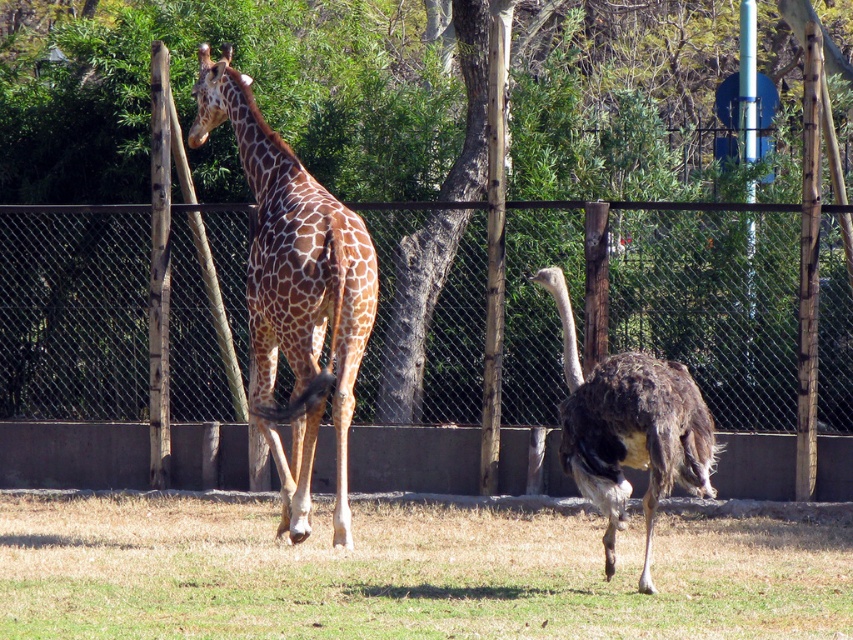
You are a zookeeper who needs to check the green dry grass at lower center and the brown spotted giraffe at center. Which object is nearer to you as you stand at the entrance of the enclosure?

The green dry grass at lower center is closer to the viewer than the brown spotted giraffe at center, so the green dry grass at lower center is nearer to you.